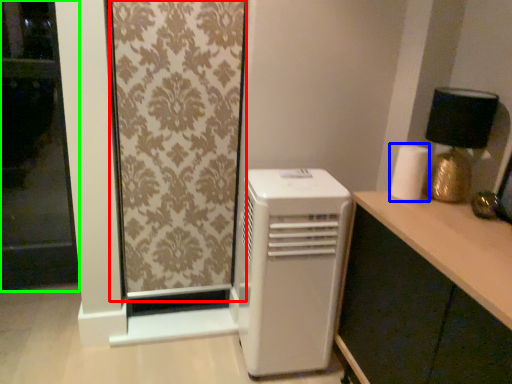
Question: Which is nearer to the curtain (highlighted by a red box)? paper towel (highlighted by a blue box) or screen door (highlighted by a green box).

Choices:
 (A) paper towel
 (B) screen door

Answer: (A)